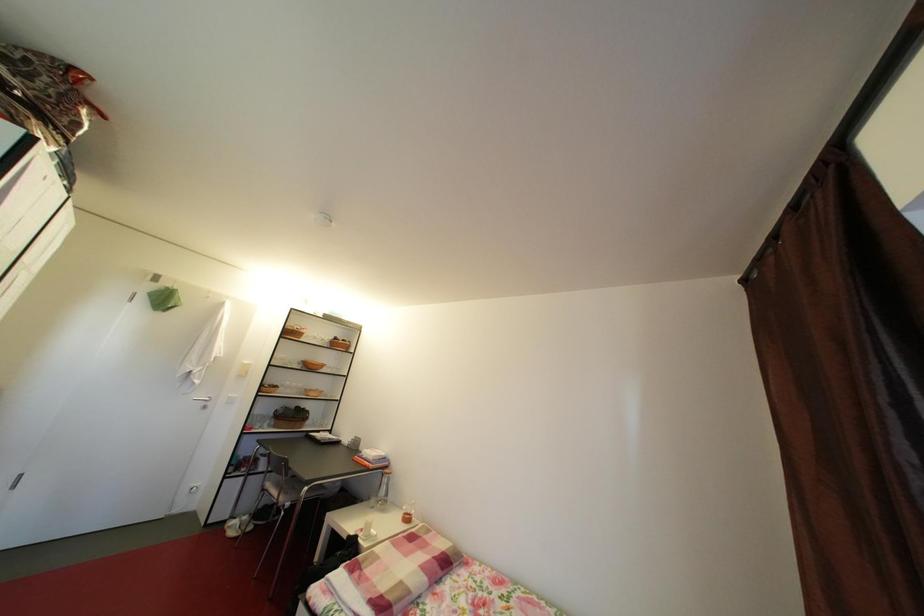
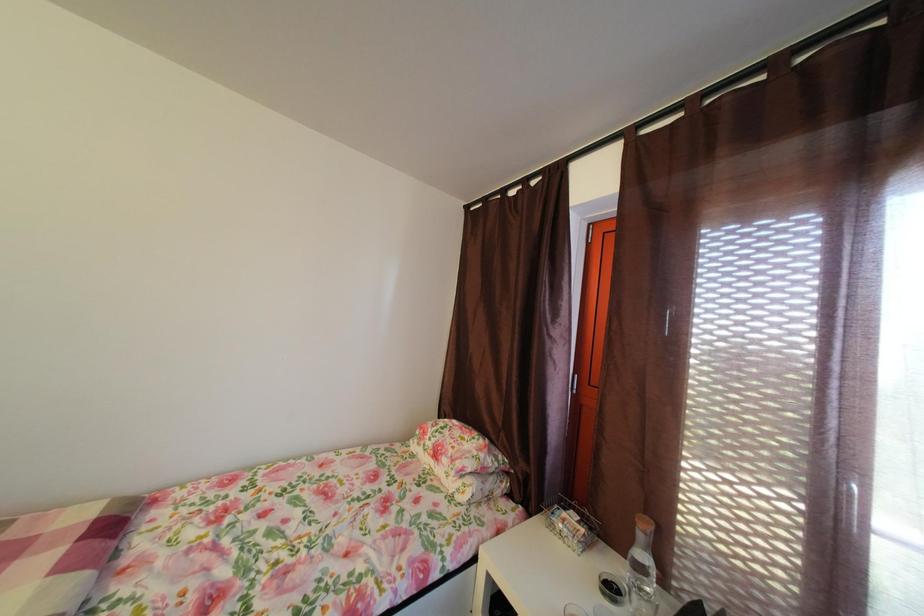
Question: Based on the continuous images, in which direction is the camera rotating? Reply with the corresponding letter.

Choices:
 (A) Left
 (B) Right
 (C) Up
 (D) Down

Answer: (B)